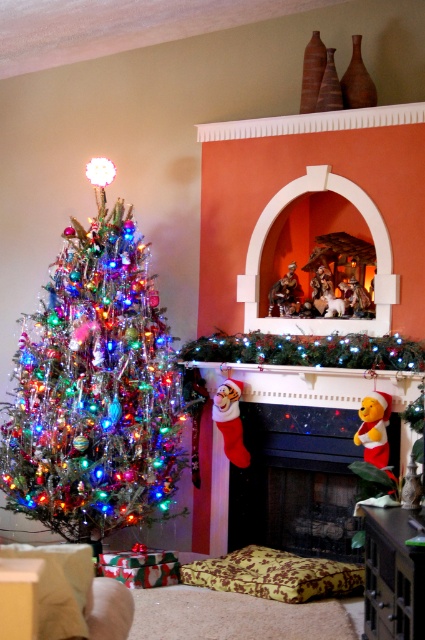
The height and width of the screenshot is (640, 425). Describe the element at coordinates (95, 387) in the screenshot. I see `shiny metallic tree at left` at that location.

At what (x,y) coordinates should I click in order to perform the action: click on shiny metallic tree at left. Please return your answer as a coordinate pair (x, y). The width and height of the screenshot is (425, 640). Looking at the image, I should click on (95, 387).

The width and height of the screenshot is (425, 640). I want to click on shiny metallic tree at left, so click(x=95, y=387).